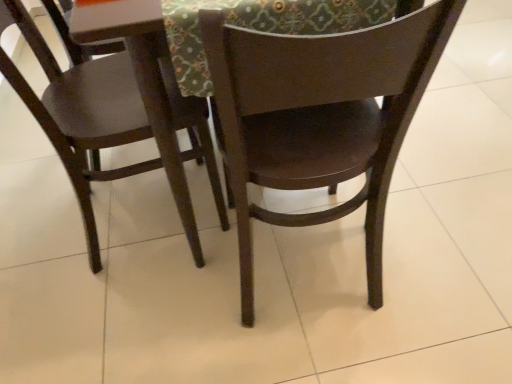
Locate an element on the screen. This screenshot has height=384, width=512. vacant area situated to the left side of matte wood chair at left, which is counted as the first chair, starting from the left is located at coordinates (42, 223).